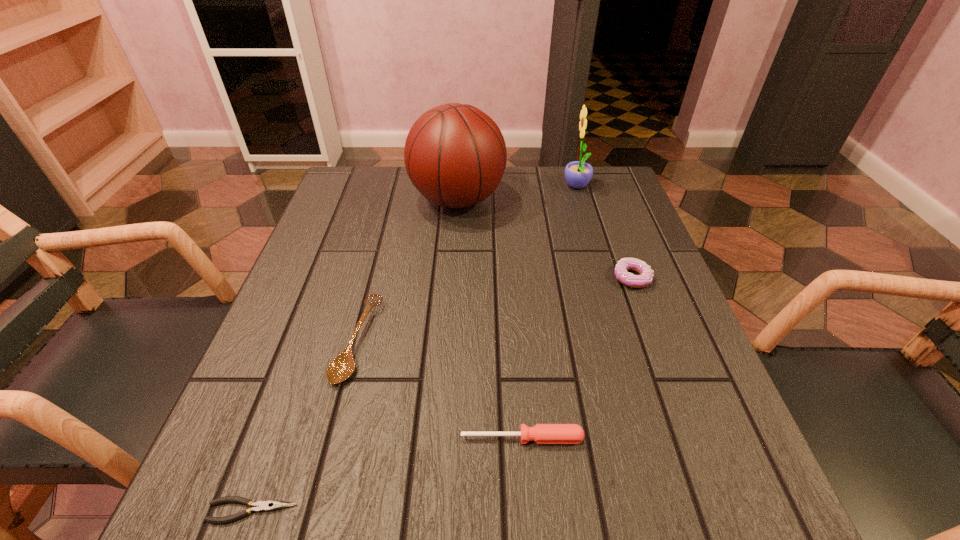
Locate an element on the screen. The width and height of the screenshot is (960, 540). blank space at the near right corner is located at coordinates (751, 531).

The image size is (960, 540). I want to click on empty space that is in between the screwdriver and the fourth farthest object, so tap(440, 389).

Where is `vacant point located between the third tallest object and the sunflower`? vacant point located between the third tallest object and the sunflower is located at coordinates [605, 233].

Locate an element on the screen. Image resolution: width=960 pixels, height=540 pixels. free space between the third tallest object and the fourth farthest object is located at coordinates (494, 309).

What are the coordinates of `empty space that is in between the fifth farthest object and the fourth shortest object` in the screenshot? It's located at (577, 358).

This screenshot has height=540, width=960. I want to click on blank region between the fourth farthest object and the second nearest object, so click(440, 389).

Identify the location of unoccupied area between the fifth farthest object and the basketball. click(490, 319).

At what (x,y) coordinates should I click in order to perform the action: click on free space that is in between the doughnut and the basketball. Please return your answer as a coordinate pair (x, y). The image size is (960, 540). Looking at the image, I should click on pyautogui.click(x=544, y=239).

Where is `free space between the third nearest object and the second nearest object`? free space between the third nearest object and the second nearest object is located at coordinates (440, 389).

At what (x,y) coordinates should I click in order to perform the action: click on vacant area that lies between the doughnut and the screwdriver. Please return your answer as a coordinate pair (x, y). Looking at the image, I should click on (577, 358).